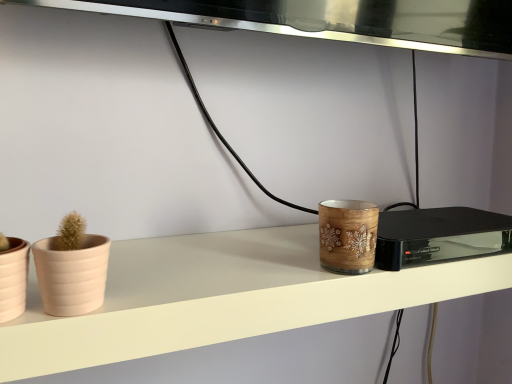
Question: From a real-world perspective, is matte pink flowerpot at left, which is the second flowerpot in right-to-left order, on beige matte flowerpot at left, positioned as the 2th flowerpot in left-to-right order?

Choices:
 (A) yes
 (B) no

Answer: (B)

Question: Considering the relative sizes of matte pink flowerpot at left, which is counted as the 1th flowerpot, starting from the left, and beige matte flowerpot at left, positioned as the 2th flowerpot in left-to-right order, in the image provided, is matte pink flowerpot at left, which is counted as the 1th flowerpot, starting from the left, thinner than beige matte flowerpot at left, positioned as the 2th flowerpot in left-to-right order,?

Choices:
 (A) no
 (B) yes

Answer: (A)

Question: Is matte pink flowerpot at left, which is counted as the 1th flowerpot, starting from the left, next to beige matte flowerpot at left, the first flowerpot from the right, and touching it?

Choices:
 (A) yes
 (B) no

Answer: (A)

Question: Is beige matte flowerpot at left, the first flowerpot from the right, at the back of matte pink flowerpot at left, which is the second flowerpot in right-to-left order?

Choices:
 (A) no
 (B) yes

Answer: (A)

Question: Is wooden candle holder at center wider or thinner than beige matte flowerpot at left, the first flowerpot from the right?

Choices:
 (A) thin
 (B) wide

Answer: (B)

Question: From a real-world perspective, is wooden candle holder at center above or below beige matte flowerpot at left, positioned as the 2th flowerpot in left-to-right order?

Choices:
 (A) below
 (B) above

Answer: (B)

Question: Is wooden candle holder at center taller or shorter than beige matte flowerpot at left, positioned as the 2th flowerpot in left-to-right order?

Choices:
 (A) short
 (B) tall

Answer: (B)

Question: From the image's perspective, is wooden candle holder at center located above or below beige matte flowerpot at left, positioned as the 2th flowerpot in left-to-right order?

Choices:
 (A) above
 (B) below

Answer: (A)

Question: Looking at the image, does wooden candle holder at center seem bigger or smaller compared to matte pink flowerpot at left, which is counted as the 1th flowerpot, starting from the left?

Choices:
 (A) small
 (B) big

Answer: (B)

Question: In the image, is wooden candle holder at center on the left side or the right side of matte pink flowerpot at left, which is counted as the 1th flowerpot, starting from the left?

Choices:
 (A) left
 (B) right

Answer: (B)

Question: In terms of height, does wooden candle holder at center look taller or shorter compared to matte pink flowerpot at left, which is the second flowerpot in right-to-left order?

Choices:
 (A) short
 (B) tall

Answer: (A)

Question: From a real-world perspective, relative to matte pink flowerpot at left, which is counted as the 1th flowerpot, starting from the left, is wooden candle holder at center vertically above or below?

Choices:
 (A) below
 (B) above

Answer: (A)

Question: Is point (194, 246) closer or farther from the camera than point (385, 268)?

Choices:
 (A) farther
 (B) closer

Answer: (A)

Question: Considering their positions, is wooden candle holder at center located in front of or behind wooden candle holder at center?

Choices:
 (A) behind
 (B) front

Answer: (B)